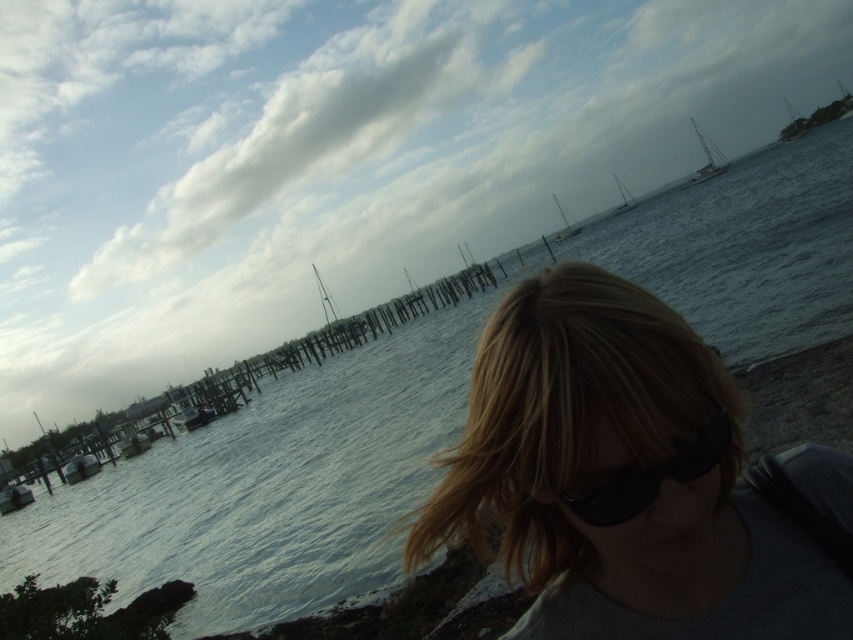
Question: Can you confirm if white plastic sailboat at upper right is positioned above white sailboat at center?

Choices:
 (A) no
 (B) yes

Answer: (B)

Question: Which point is closer to the camera taking this photo?

Choices:
 (A) (781, 141)
 (B) (723, 161)
 (C) (642, 477)

Answer: (C)

Question: Which point appears farthest from the camera in this image?

Choices:
 (A) (697, 458)
 (B) (795, 109)
 (C) (704, 173)
 (D) (633, 202)

Answer: (B)

Question: Which of the following is the closest to the observer?

Choices:
 (A) (566, 227)
 (B) (793, 109)
 (C) (614, 173)

Answer: (A)

Question: Is black matte sunglasses at center positioned before white sailboat at upper right?

Choices:
 (A) no
 (B) yes

Answer: (B)

Question: Can you confirm if white sailboat at center is positioned to the left of white matte sailboat at upper center?

Choices:
 (A) no
 (B) yes

Answer: (A)